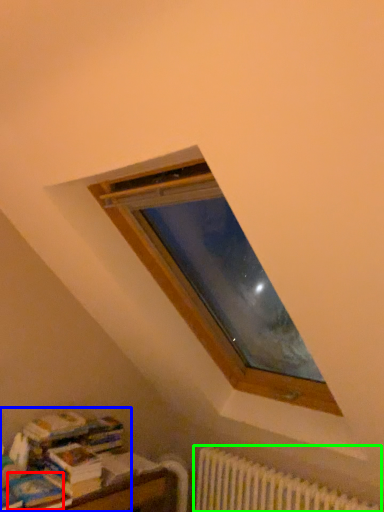
Question: Which object is the closest to the paperback book (highlighted by a red box)? Choose among these: book (highlighted by a blue box) or radiator (highlighted by a green box).

Choices:
 (A) book
 (B) radiator

Answer: (A)